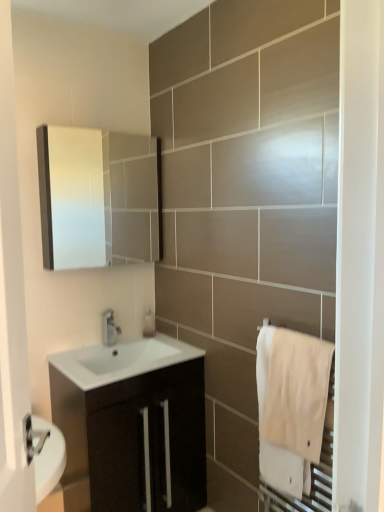
Question: Is matte white medicine cabinet at upper left outside white glossy sink at center?

Choices:
 (A) yes
 (B) no

Answer: (A)

Question: Is matte white medicine cabinet at upper left oriented away from white glossy sink at center?

Choices:
 (A) no
 (B) yes

Answer: (A)

Question: Considering the relative positions of matte white medicine cabinet at upper left and white glossy sink at center in the image provided, is matte white medicine cabinet at upper left to the right of white glossy sink at center from the viewer's perspective?

Choices:
 (A) yes
 (B) no

Answer: (B)

Question: Can you confirm if matte white medicine cabinet at upper left is positioned to the left of white glossy sink at center?

Choices:
 (A) no
 (B) yes

Answer: (B)

Question: From the image's perspective, is matte white medicine cabinet at upper left above white glossy sink at center?

Choices:
 (A) no
 (B) yes

Answer: (B)

Question: Is matte black cabinet at center inside or outside of clear plastic soap dispenser at center?

Choices:
 (A) inside
 (B) outside

Answer: (B)

Question: Does point (190, 468) appear closer or farther from the camera than point (152, 318)?

Choices:
 (A) closer
 (B) farther

Answer: (A)

Question: Visually, is matte black cabinet at center positioned to the left or to the right of clear plastic soap dispenser at center?

Choices:
 (A) right
 (B) left

Answer: (B)

Question: From a real-world perspective, relative to clear plastic soap dispenser at center, is matte black cabinet at center vertically above or below?

Choices:
 (A) below
 (B) above

Answer: (A)

Question: From a real-world perspective, is white cotton towel at right above or below matte black cabinet at center?

Choices:
 (A) below
 (B) above

Answer: (B)

Question: Considering the positions of point (297, 477) and point (147, 343), is point (297, 477) closer or farther from the camera than point (147, 343)?

Choices:
 (A) farther
 (B) closer

Answer: (B)

Question: Is white cotton towel at right bigger or smaller than matte black cabinet at center?

Choices:
 (A) big
 (B) small

Answer: (B)

Question: From the image's perspective, is white cotton towel at right above or below matte black cabinet at center?

Choices:
 (A) above
 (B) below

Answer: (A)

Question: Looking at the image, does white cotton towel at right seem bigger or smaller compared to clear plastic soap dispenser at center?

Choices:
 (A) small
 (B) big

Answer: (B)

Question: In terms of height, does white cotton towel at right look taller or shorter compared to clear plastic soap dispenser at center?

Choices:
 (A) short
 (B) tall

Answer: (B)